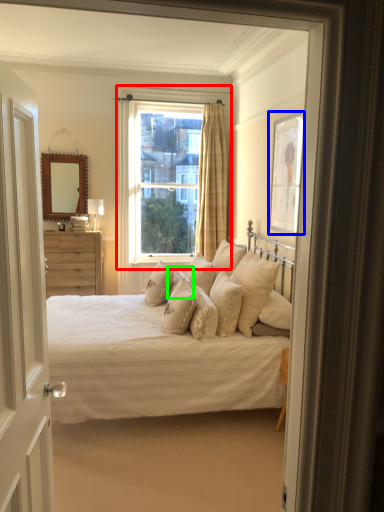
Question: Which object is positioned closest to window (highlighted by a red box)? Select from picture frame (highlighted by a blue box) and pillow (highlighted by a green box).

Choices:
 (A) picture frame
 (B) pillow

Answer: (A)